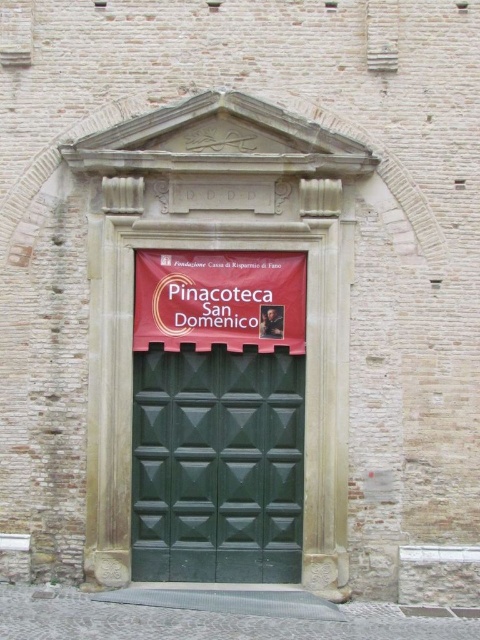
Question: Observing the image, what is the correct spatial positioning of green textured door at center in reference to red fabric banner at center?

Choices:
 (A) above
 (B) below

Answer: (B)

Question: Can you confirm if green textured door at center is thinner than red fabric banner at center?

Choices:
 (A) no
 (B) yes

Answer: (A)

Question: Among these objects, which one is farthest from the camera?

Choices:
 (A) green textured door at center
 (B) red fabric banner at center

Answer: (A)

Question: Considering the relative positions of green textured door at center and red fabric banner at center in the image provided, where is green textured door at center located with respect to red fabric banner at center?

Choices:
 (A) left
 (B) right

Answer: (A)